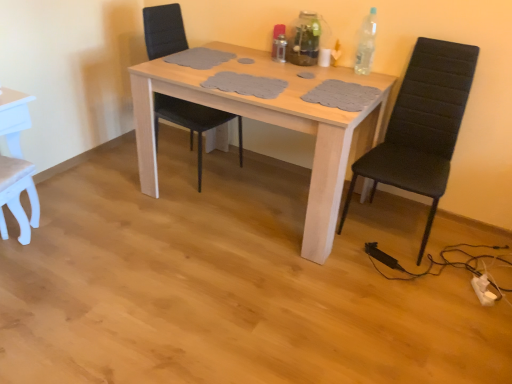
Where is `free space in front of metallic silver bottle at upper center, arranged as the third bottle when viewed from the right`? free space in front of metallic silver bottle at upper center, arranged as the third bottle when viewed from the right is located at coordinates (288, 64).